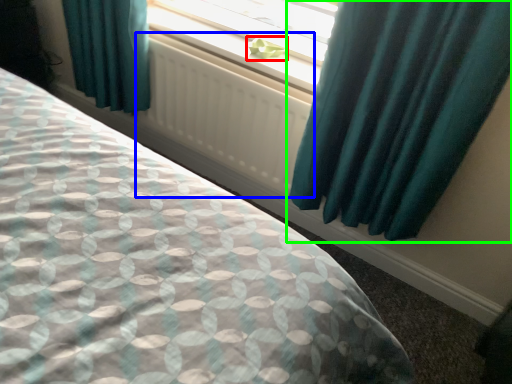
Question: Based on their relative distances, which object is nearer to plant (highlighted by a red box)? Choose from radiator (highlighted by a blue box) and curtain (highlighted by a green box).

Choices:
 (A) radiator
 (B) curtain

Answer: (A)